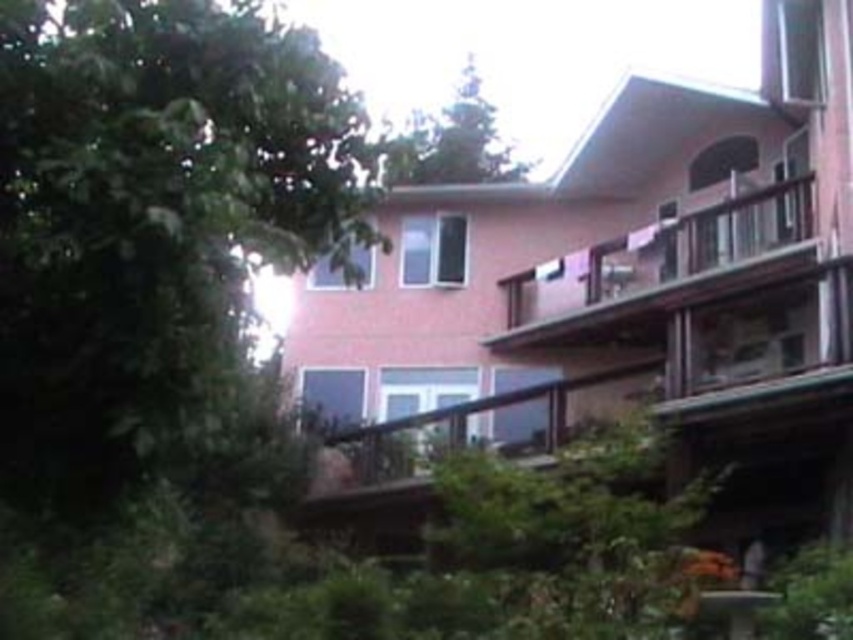
Between brown wooden balcony at upper right and green leafy tree at upper center, which one appears on the left side from the viewer's perspective?

green leafy tree at upper center is more to the left.

Does point (566, 323) come closer to viewer compared to point (410, 160)?

No, it is behind (410, 160).

In order to click on brown wooden balcony at upper right in this screenshot , I will do `click(664, 264)`.